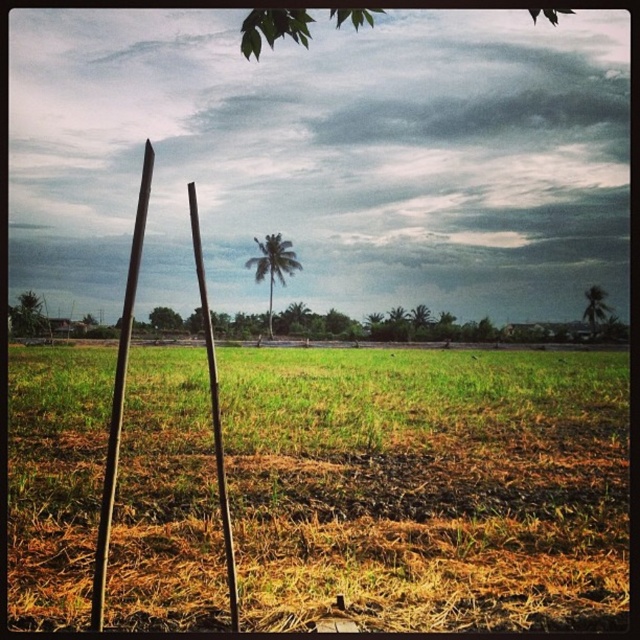
Does brown dry grass at center have a greater width compared to smooth brown pole at center?

Indeed, brown dry grass at center has a greater width compared to smooth brown pole at center.

Measure the distance between brown dry grass at center and smooth brown pole at center.

The distance of brown dry grass at center from smooth brown pole at center is 36.11 feet.

Does point (588, 515) lie in front of point (200, 285)?

Yes, point (588, 515) is closer to viewer.

Locate an element on the screen. The image size is (640, 640). brown dry grass at center is located at coordinates (428, 486).

Is green leafy tree at left positioned before green leafy tree at center?

Yes, it is.

Is green leafy tree at left positioned at the back of green leafy tree at center?

No.

Find the location of `green leafy tree at left`. green leafy tree at left is located at coordinates (28, 316).

I want to click on green leafy palm at center, so click(273, 266).

Is green leafy palm at center to the right of green leafy tree at center from the viewer's perspective?

Yes, green leafy palm at center is to the right of green leafy tree at center.

What are the coordinates of `green leafy palm at center` in the screenshot? It's located at (273, 266).

Identify the location of green leafy palm at center. (273, 266).